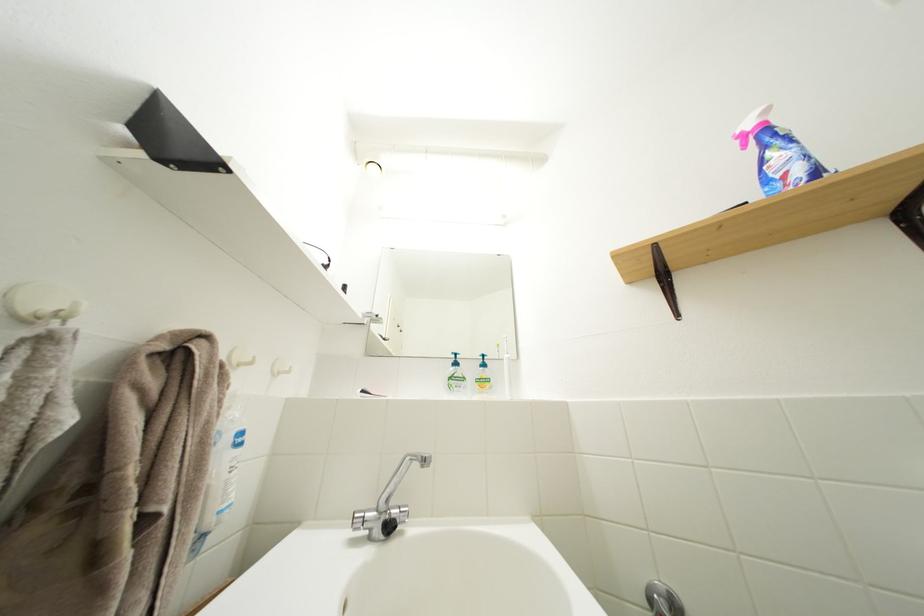
The height and width of the screenshot is (616, 924). Identify the location of chrome faucet handle. (363, 519).